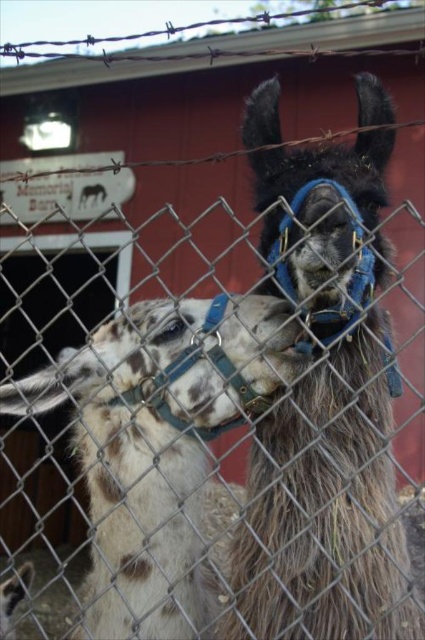
Can you confirm if dark brown woolen alpaca at center is bigger than speckled wool alpaca at left?

No, dark brown woolen alpaca at center is not bigger than speckled wool alpaca at left.

Is point (367, 522) positioned in front of point (186, 465)?

Yes, it is.

At what (x,y) coordinates should I click in order to perform the action: click on dark brown woolen alpaca at center. Please return your answer as a coordinate pair (x, y). This screenshot has height=640, width=425. Looking at the image, I should click on (325, 401).